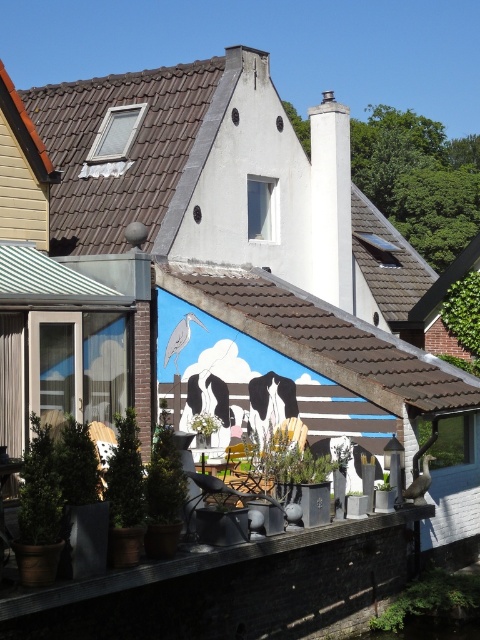
You are a gardener who wants to plant a new shrub in the garden next to the house. You have two options for placement based on the image. The first option is next to the green leafy plant at lower right, and the second is next to the green matte plant at center. Which location would provide more vertical space for the new shrub to grow?

The green leafy plant at lower right is taller than the green matte plant at center, so planting next to the green leafy plant at lower right would provide more vertical space for the new shrub to grow.